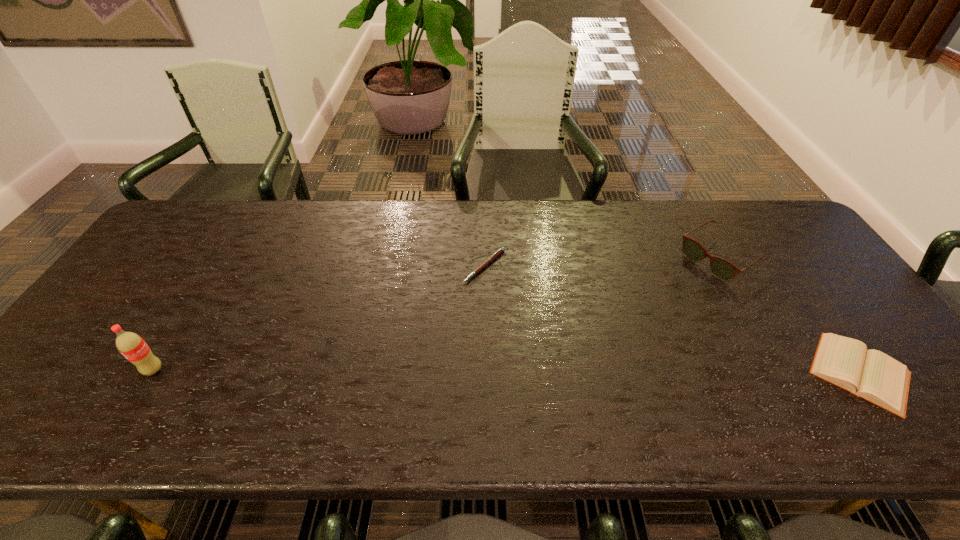
Find the location of a particular element. unoccupied area between the second object from left to right and the leftmost object is located at coordinates (319, 318).

Locate an element on the screen. vacant area that lies between the tallest object and the diary is located at coordinates (507, 371).

Image resolution: width=960 pixels, height=540 pixels. Identify the location of vacant area that lies between the third tallest object and the tallest object. (507, 371).

The height and width of the screenshot is (540, 960). What are the coordinates of `unoccupied area between the second object from left to right and the third shortest object` in the screenshot? It's located at (602, 262).

At what (x,y) coordinates should I click in order to perform the action: click on vacant space that's between the third tallest object and the pen. Please return your answer as a coordinate pair (x, y). Looking at the image, I should click on (672, 319).

Locate an element on the screen. Image resolution: width=960 pixels, height=540 pixels. object that stands as the closest to the tallest object is located at coordinates (501, 250).

Where is `object that ranks as the closest to the tallest object`? object that ranks as the closest to the tallest object is located at coordinates (501, 250).

Where is `vacant position in the image that satisfies the following two spatial constraints: 1. on the back side of the spectacles; 2. on the left side of the leftmost object`? This screenshot has width=960, height=540. vacant position in the image that satisfies the following two spatial constraints: 1. on the back side of the spectacles; 2. on the left side of the leftmost object is located at coordinates (222, 258).

Where is `free location that satisfies the following two spatial constraints: 1. on the front side of the second object from left to right; 2. on the right side of the diary`? Image resolution: width=960 pixels, height=540 pixels. free location that satisfies the following two spatial constraints: 1. on the front side of the second object from left to right; 2. on the right side of the diary is located at coordinates (487, 373).

Locate an element on the screen. The image size is (960, 540). free space that satisfies the following two spatial constraints: 1. on the back side of the second object from left to right; 2. on the right side of the third shortest object is located at coordinates (485, 258).